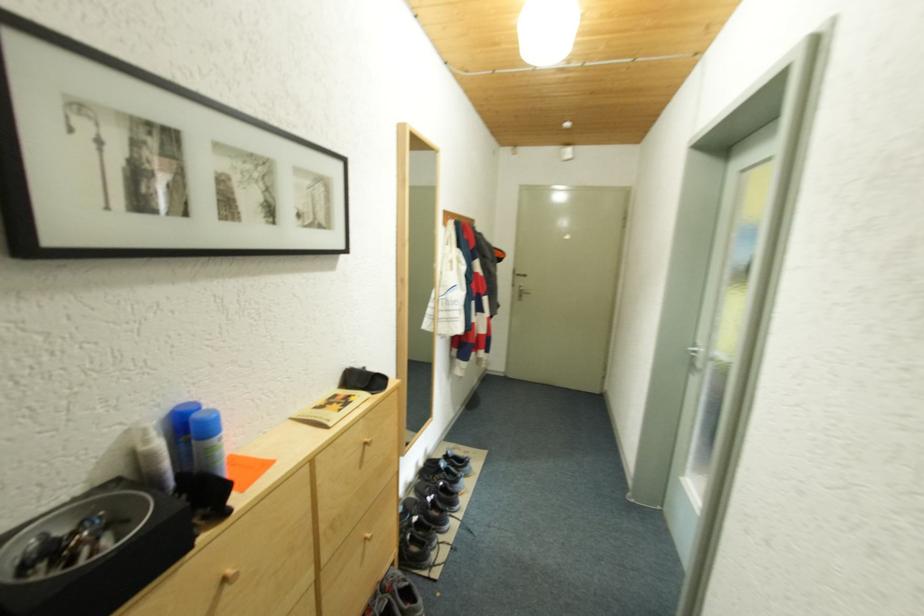
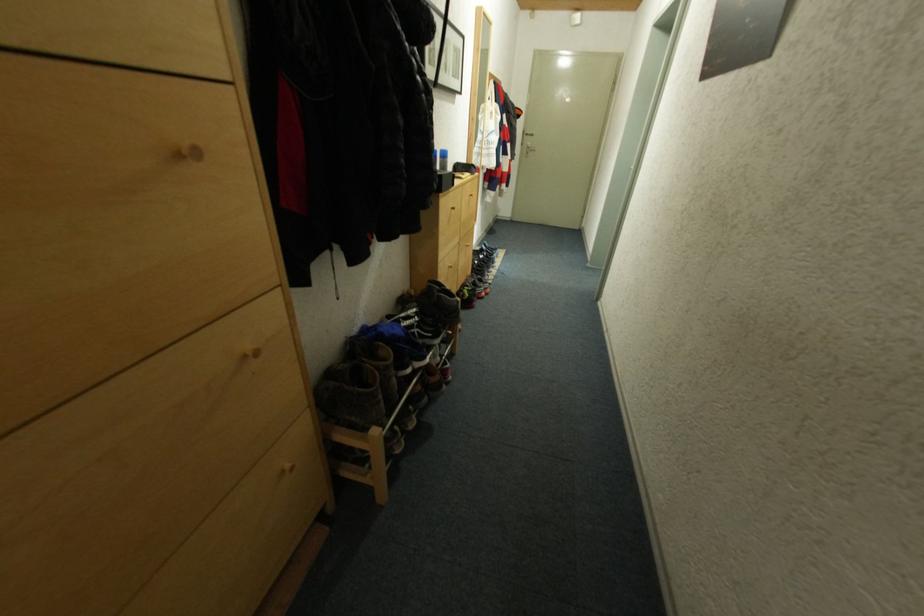
In a continuous first-person perspective shot, in which direction is the camera moving?

The cameraman walked toward left, backward.